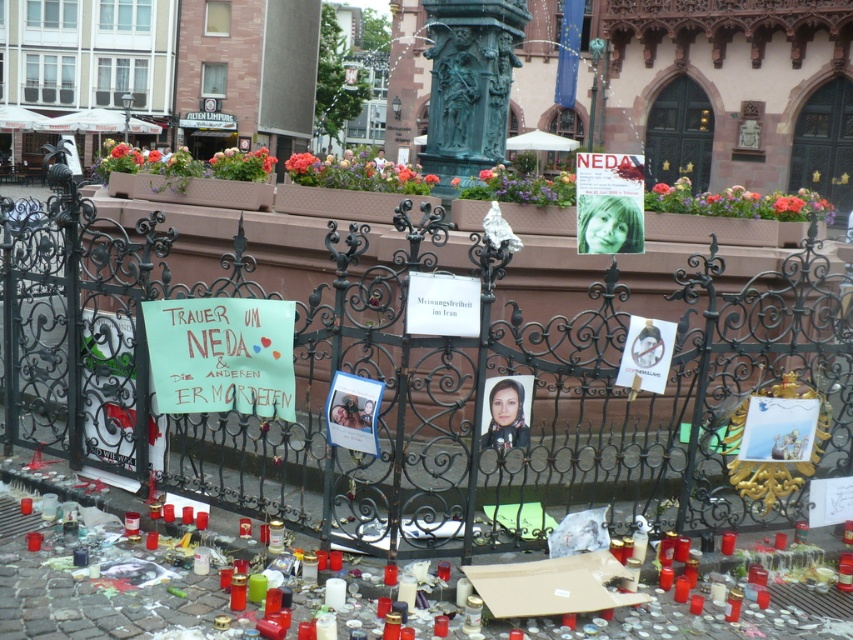
Is black wrought iron fence at center smaller than matte paper poster at center?

No.

Measure the distance between black wrought iron fence at center and camera.

black wrought iron fence at center is 9.79 meters away from camera.

Locate an element on the screen. The image size is (853, 640). black wrought iron fence at center is located at coordinates (415, 387).

How distant is matte paper poster at center from matte paper photo frame at center?

A distance of 6.92 feet exists between matte paper poster at center and matte paper photo frame at center.

Is matte paper poster at center shorter than matte paper photo frame at center?

Incorrect, matte paper poster at center's height does not fall short of matte paper photo frame at center's.

Does point (595, 157) come farther from viewer compared to point (367, 451)?

Yes, point (595, 157) is farther from viewer.

You are a GUI agent. You are given a task and a screenshot of the screen. Output one action in this format:
    pyautogui.click(x=<x>, y=<y>)
    Task: Click on the matte paper poster at center
    The image size is (853, 640).
    Given the screenshot: What is the action you would take?
    pyautogui.click(x=608, y=204)

Does green patinated bronze statue at center appear on the left side of matte paper poster at center?

Indeed, green patinated bronze statue at center is positioned on the left side of matte paper poster at center.

Between green patinated bronze statue at center and matte paper poster at center, which one appears on the left side from the viewer's perspective?

Positioned to the left is green patinated bronze statue at center.

Locate an element on the screen. green patinated bronze statue at center is located at coordinates (469, 84).

In order to click on green patinated bronze statue at center in this screenshot , I will do `click(469, 84)`.